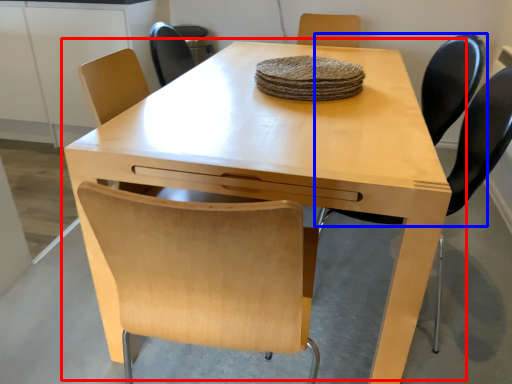
Question: Which object is closer to the camera taking this photo, table (highlighted by a red box) or chair (highlighted by a blue box)?

Choices:
 (A) table
 (B) chair

Answer: (A)